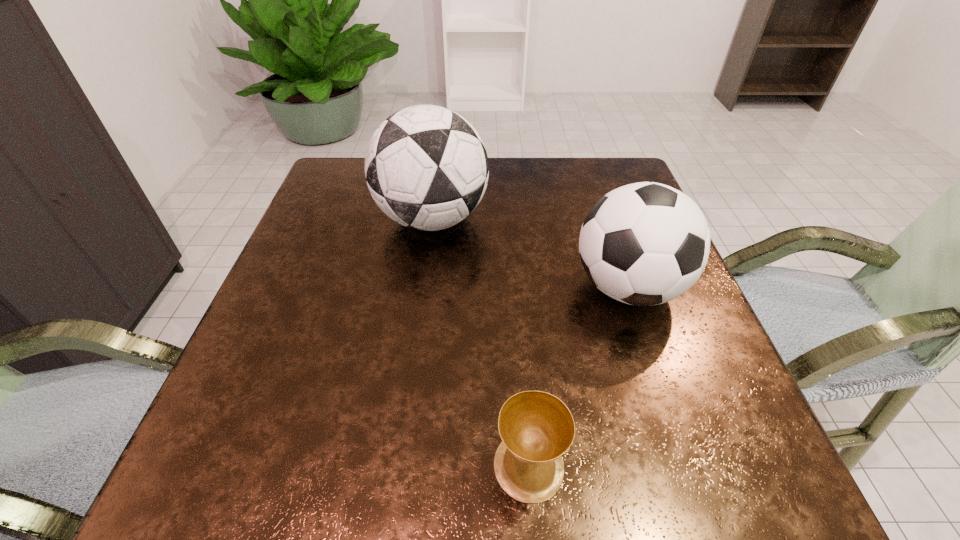
In order to click on the left soccer ball in this screenshot , I will do `click(426, 167)`.

I want to click on the leftmost object, so click(426, 167).

Identify the location of the shorter soccer ball. This screenshot has height=540, width=960. (646, 243).

What are the coordinates of `the second shortest object` in the screenshot? It's located at (646, 243).

The height and width of the screenshot is (540, 960). In order to click on the shortest object in this screenshot , I will do `click(537, 428)`.

Locate an element on the screen. The width and height of the screenshot is (960, 540). the nearest object is located at coordinates (537, 428).

Where is `free location located 0.240m on the surface of the leftmost object where the brand logo is visible`? free location located 0.240m on the surface of the leftmost object where the brand logo is visible is located at coordinates (588, 219).

You are a GUI agent. You are given a task and a screenshot of the screen. Output one action in this format:
    pyautogui.click(x=<x>, y=<y>)
    Task: Click on the free point located 0.370m on the left of the shorter soccer ball
    Image resolution: width=960 pixels, height=540 pixels.
    Given the screenshot: What is the action you would take?
    pyautogui.click(x=390, y=287)

This screenshot has height=540, width=960. Identify the location of free space located 0.060m on the right of the shortest object. (605, 465).

Identify the location of object located in the far edge section of the desktop. (426, 167).